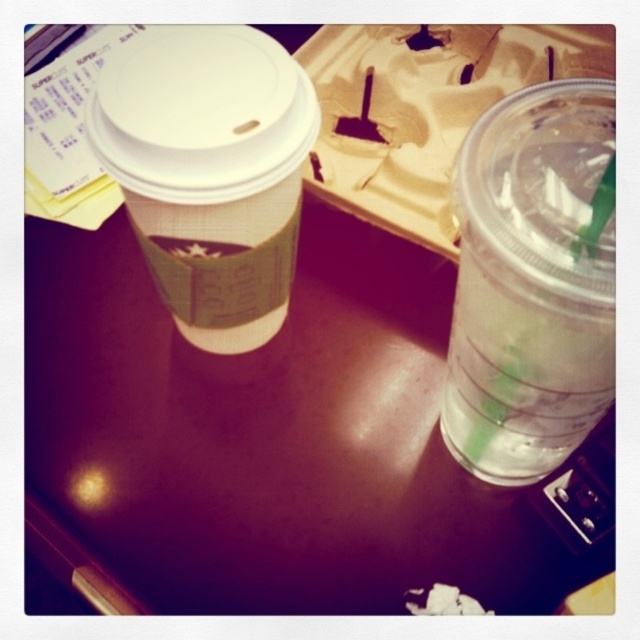
Question: Which point is closer to the camera taking this photo?

Choices:
 (A) (168, 269)
 (B) (467, 204)

Answer: (B)

Question: In this image, where is clear plastic cup at right located relative to brown paper cup at upper left?

Choices:
 (A) above
 (B) below

Answer: (B)

Question: Which object is farther from the camera taking this photo?

Choices:
 (A) brown paper cup at upper left
 (B) clear plastic cup at right

Answer: (A)

Question: Is the position of clear plastic cup at right more distant than that of brown paper cup at upper left?

Choices:
 (A) yes
 (B) no

Answer: (B)

Question: Does clear plastic cup at right appear under brown paper cup at upper left?

Choices:
 (A) no
 (B) yes

Answer: (B)

Question: Which of the following is the closest to the observer?

Choices:
 (A) clear plastic cup at right
 (B) brown paper cup at upper left

Answer: (A)